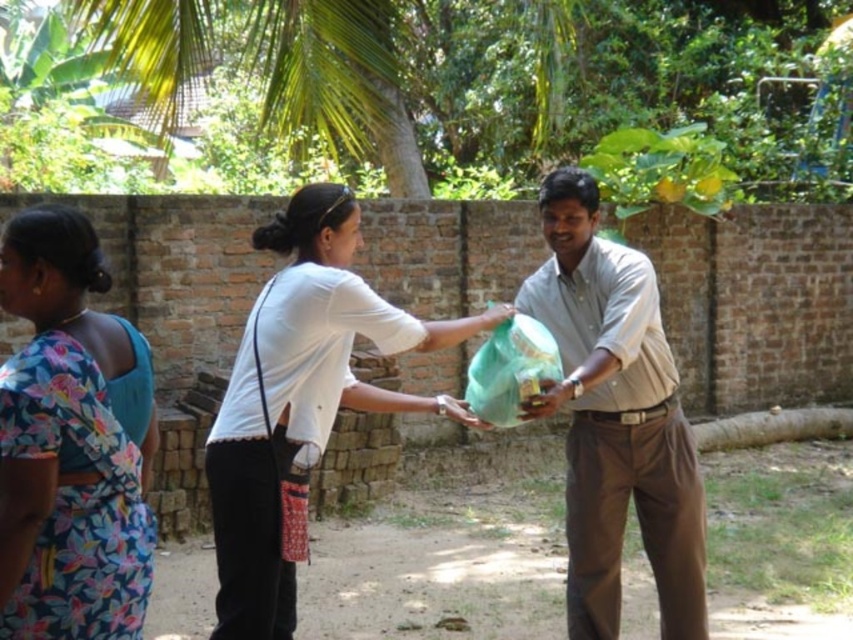
You are a photographer trying to capture a closeup of the white matte shirt at center and the matte green bag at center. Which object should you zoom in on to ensure it appears larger in your photo?

The matte green bag at center should be zoomed in on because it is taller than the white matte shirt at center, making it naturally larger in the frame.

You are a photographer trying to capture a closeup of the white matte shirt at center and the matte green bag at center. Since the camera can only focus on one object at a time, which object should you focus on first to ensure it appears larger in the frame?

The white matte shirt at center is smaller than the matte green bag at center, so to ensure it appears larger in the frame, you should focus on the white matte shirt at center first.